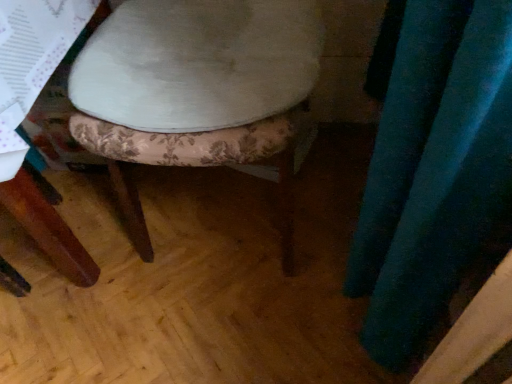
At what (x,y) coordinates should I click in order to perform the action: click on vacant area in front of velvet floral-patterned stool at center. Please return your answer as a coordinate pair (x, y). The width and height of the screenshot is (512, 384). Looking at the image, I should click on (228, 320).